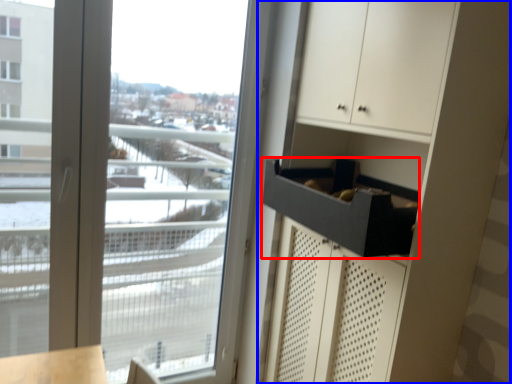
Question: Among these objects, which one is nearest to the camera, drawer (highlighted by a red box) or dresser (highlighted by a blue box)?

Choices:
 (A) drawer
 (B) dresser

Answer: (B)